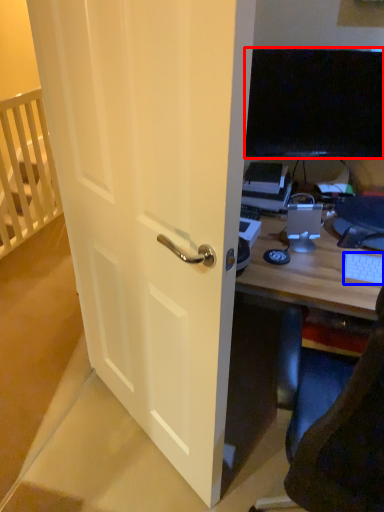
Question: Among these objects, which one is farthest to the camera, television (highlighted by a red box) or computer keyboard (highlighted by a blue box)?

Choices:
 (A) television
 (B) computer keyboard

Answer: (A)